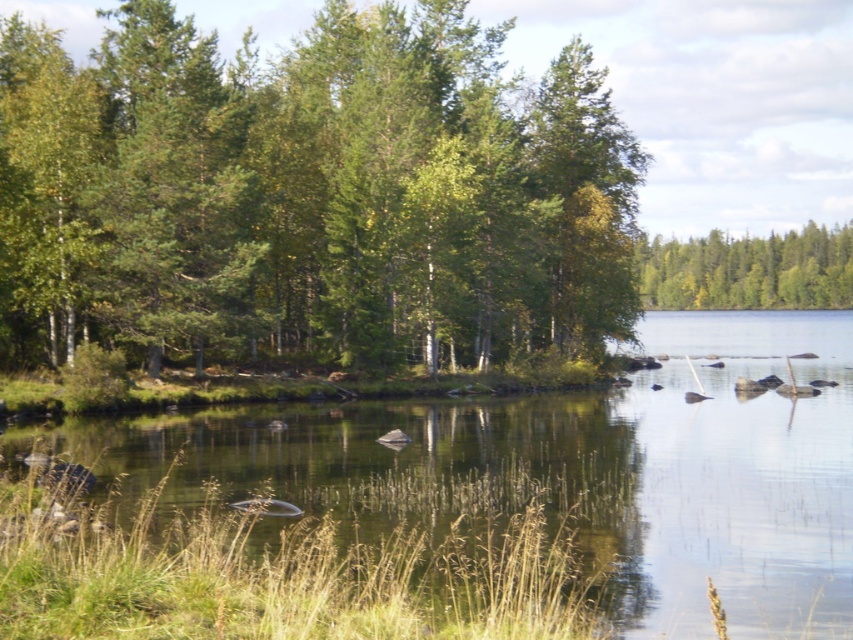
In the scene shown: Based on the scene description, where is the green leafy trees at center located in terms of its 2D coordinates?

The green leafy trees at center are located at the 2D coordinates of point (310, 195).

You are standing at the edge of the lake and want to walk towards the green leafy trees at center and the green leafy trees at upper right. Which group of trees will you reach first?

You will reach the green leafy trees at center first because they are closer to you than the green leafy trees at upper right.

You are standing on the shore looking at the green leafy trees at center and the green leafy trees at upper right. Which group of trees is positioned higher in the image?

The green leafy trees at center are positioned higher in the image than the green leafy trees at upper right.